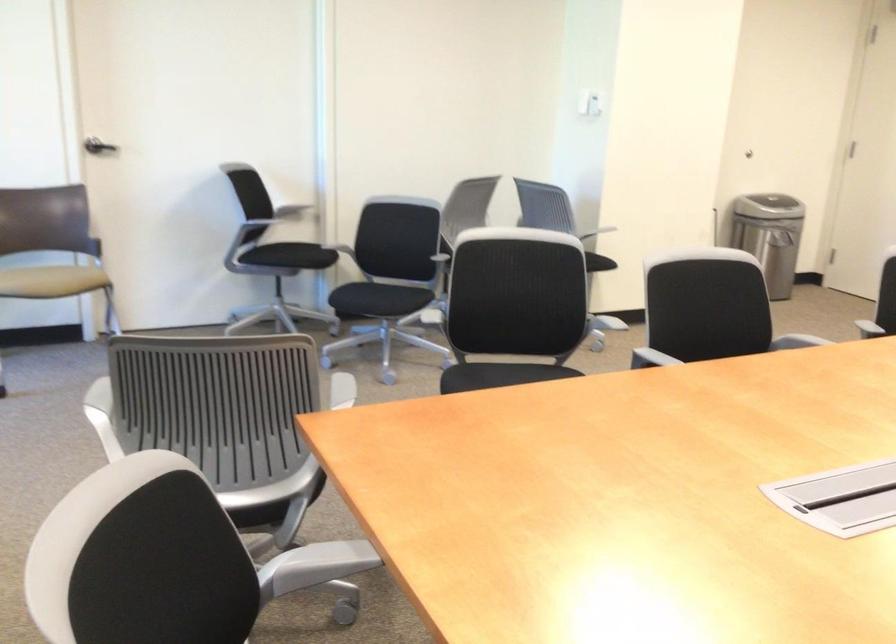
Image resolution: width=896 pixels, height=644 pixels. What are the coordinates of `white light switch` in the screenshot? It's located at (590, 102).